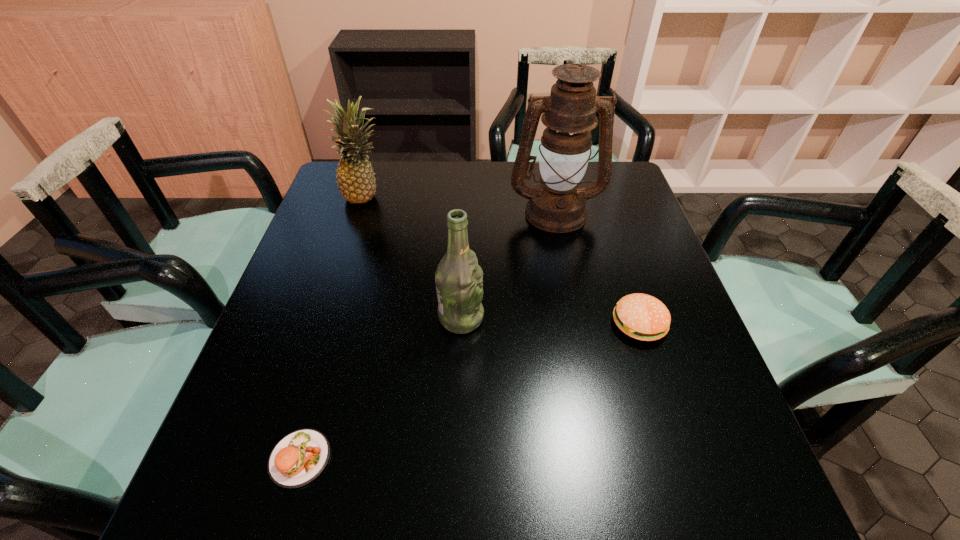
You are a GUI agent. You are given a task and a screenshot of the screen. Output one action in this format:
    pyautogui.click(x=<x>, y=<y>)
    Task: Click on the oil lamp
    
    Given the screenshot: What is the action you would take?
    pyautogui.click(x=557, y=205)

The width and height of the screenshot is (960, 540). Find the location of `pineapple`. pineapple is located at coordinates (355, 177).

At what (x,y) coordinates should I click in order to perform the action: click on the third object from right to left. Please return your answer as a coordinate pair (x, y). The height and width of the screenshot is (540, 960). Looking at the image, I should click on coord(458,278).

This screenshot has height=540, width=960. In order to click on the right patty in this screenshot , I will do `click(643, 317)`.

Where is `the farther patty`? the farther patty is located at coordinates (643, 317).

You are a GUI agent. You are given a task and a screenshot of the screen. Output one action in this format:
    pyautogui.click(x=<x>, y=<y>)
    Task: Click on the nearer patty
    
    Given the screenshot: What is the action you would take?
    pyautogui.click(x=300, y=457)

Locate an element on the screen. the nearest object is located at coordinates (300, 457).

Locate an element on the screen. This screenshot has height=540, width=960. free space located 0.360m on the front of the tallest object is located at coordinates (581, 341).

The height and width of the screenshot is (540, 960). In order to click on vacant point located on the front of the pineapple in this screenshot , I will do `click(358, 221)`.

This screenshot has width=960, height=540. Identify the location of vacant space located on the surface of the third object from right to left. (519, 318).